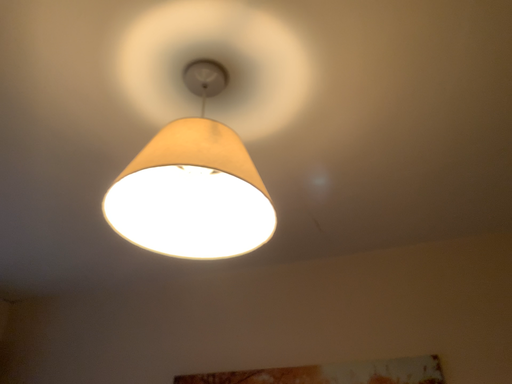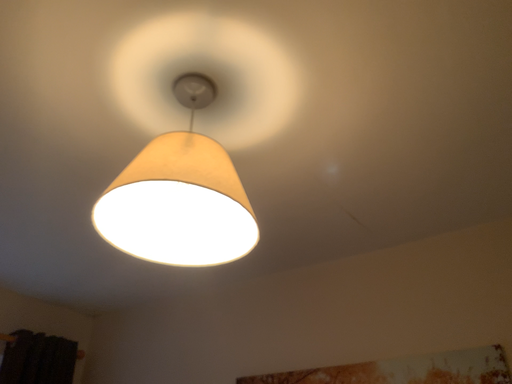
Question: Which way did the camera rotate in the video?

Choices:
 (A) rotated left
 (B) rotated right

Answer: (A)